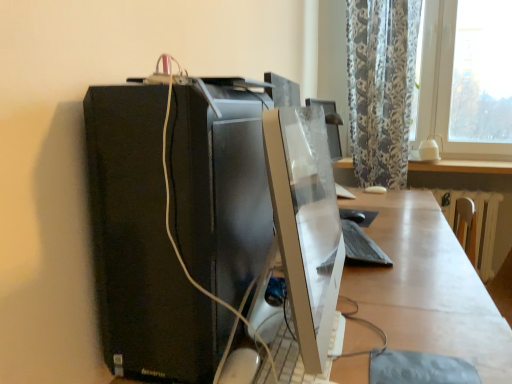
The height and width of the screenshot is (384, 512). I want to click on vacant space in front of black matte keyboard at center, so click(402, 276).